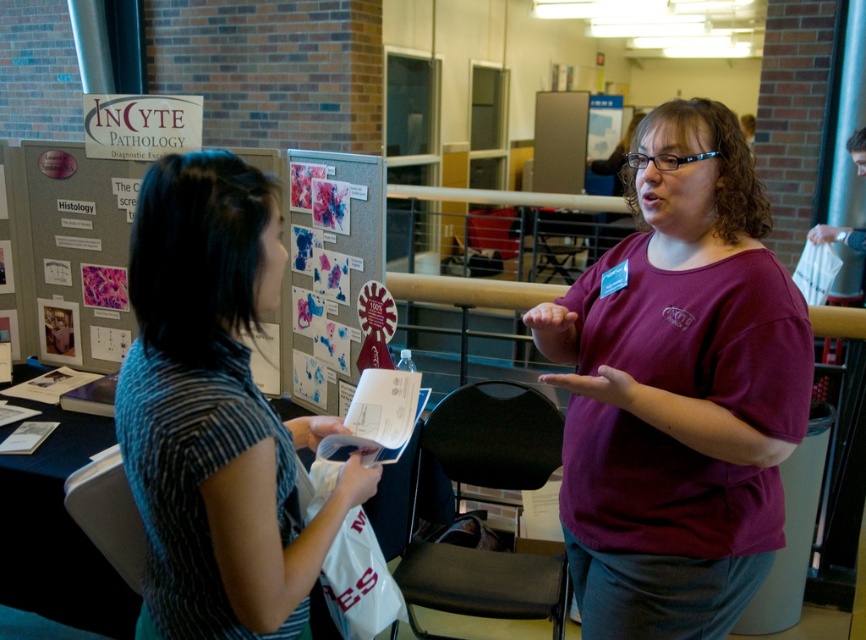
You are standing at the point labeled as point (57, 280) and want to reach the point labeled as point (699, 602). Is there any obstruction between these two points that you need to be aware of?

The point (699, 602) is in front of point (57, 280), so there is no obstruction between them.

Based on the photo, you are standing in the conference room and need to hand a document to the person wearing the striped fabric shirt at center. There is also a matte gray bulletin board at center. Which object is closer to you?

The striped fabric shirt at center is closer to the viewer than the matte gray bulletin board at center, so you should hand the document to the striped fabric shirt at center first as it is nearer.